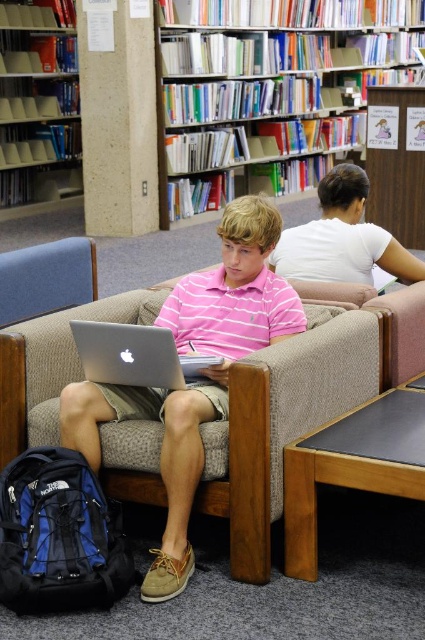
Question: Is matte plastic bookshelf at upper left below silver metallic laptop at center?

Choices:
 (A) yes
 (B) no

Answer: (B)

Question: Which point is closer to the camera taking this photo?

Choices:
 (A) (285, 273)
 (B) (241, 573)
 (C) (314, 120)

Answer: (B)

Question: Does beige fabric couch at center have a greater width compared to silver metallic laptop at center?

Choices:
 (A) yes
 (B) no

Answer: (A)

Question: In this image, where is white glossy bookshelf at upper center located relative to beige fabric couch at center?

Choices:
 (A) above
 (B) below

Answer: (A)

Question: Which of these objects is positioned closest to the white matte shirt at upper right?

Choices:
 (A) silver metallic laptop at center
 (B) beige fabric couch at center
 (C) white glossy bookshelf at upper center

Answer: (B)

Question: Which point is farther from the camera taking this photo?

Choices:
 (A) (57, 200)
 (B) (340, 58)
 (C) (3, 365)

Answer: (B)